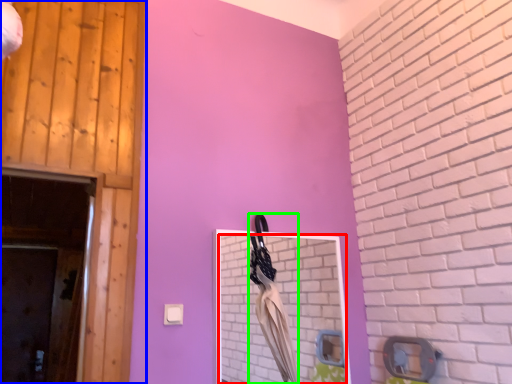
Question: Which object is positioned farthest from mirror (highlighted by a red box)? Select from door (highlighted by a blue box) and laundry (highlighted by a green box).

Choices:
 (A) door
 (B) laundry

Answer: (A)